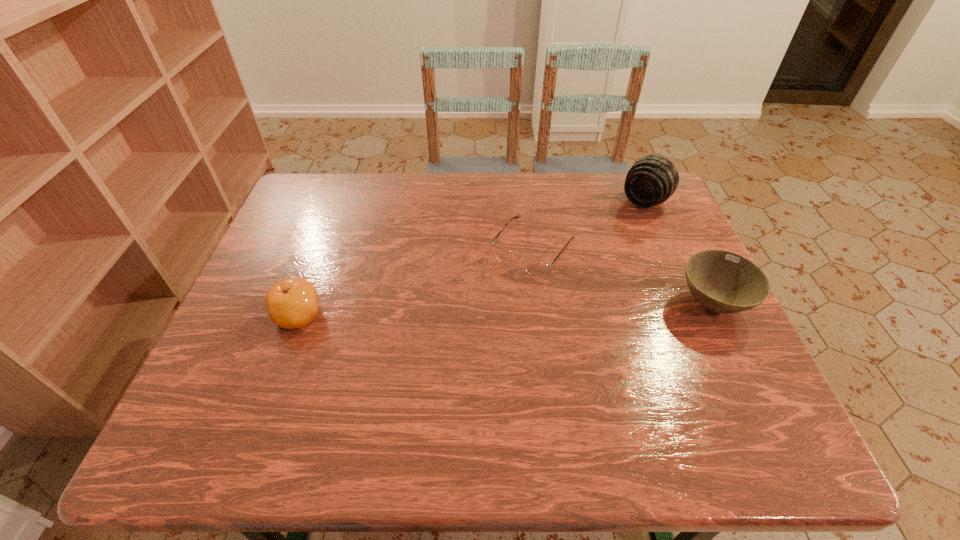
Locate an element on the screen. The height and width of the screenshot is (540, 960). the leftmost object is located at coordinates (291, 303).

Locate an element on the screen. The width and height of the screenshot is (960, 540). bowl is located at coordinates (724, 282).

At what (x,y) coordinates should I click in order to perform the action: click on the second object from left to right. Please return your answer as a coordinate pair (x, y). This screenshot has width=960, height=540. Looking at the image, I should click on (534, 267).

Where is `spectacles`? spectacles is located at coordinates (534, 267).

The image size is (960, 540). I want to click on the farthest object, so click(653, 179).

Identify the location of the tallest object. The height and width of the screenshot is (540, 960). (653, 179).

Identify the location of vacant space located 0.150m on the front of the leftmost object. This screenshot has height=540, width=960. (x=269, y=397).

Where is `vacant region located on the left of the bowl`? The width and height of the screenshot is (960, 540). vacant region located on the left of the bowl is located at coordinates (507, 303).

You are a GUI agent. You are given a task and a screenshot of the screen. Output one action in this format:
    pyautogui.click(x=<x>, y=<y>)
    Task: Click on the free space located 0.290m on the front-facing side of the second object from left to right
    The height and width of the screenshot is (540, 960).
    Given the screenshot: What is the action you would take?
    [449, 361]

Image resolution: width=960 pixels, height=540 pixels. Find the location of `vacant space positioned on the front-facing side of the second object from left to right`. vacant space positioned on the front-facing side of the second object from left to right is located at coordinates (449, 361).